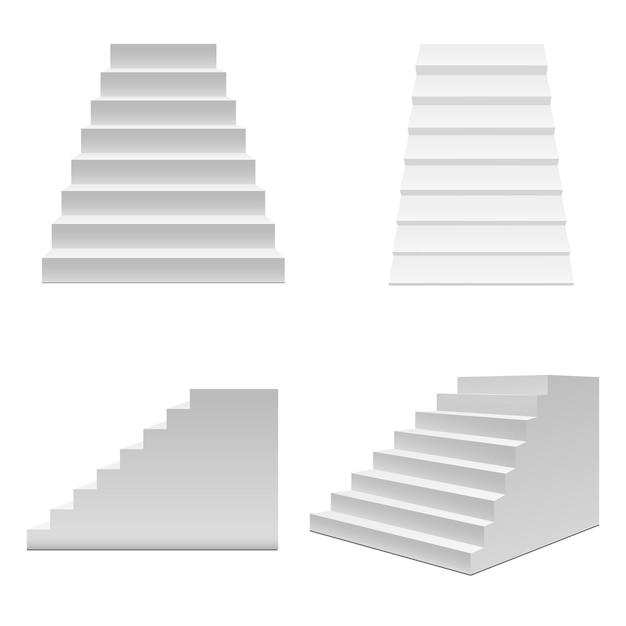
Image resolution: width=626 pixels, height=626 pixels. In order to click on white staircase in this screenshot , I will do `click(167, 154)`, `click(475, 205)`, `click(490, 494)`, `click(168, 474)`.